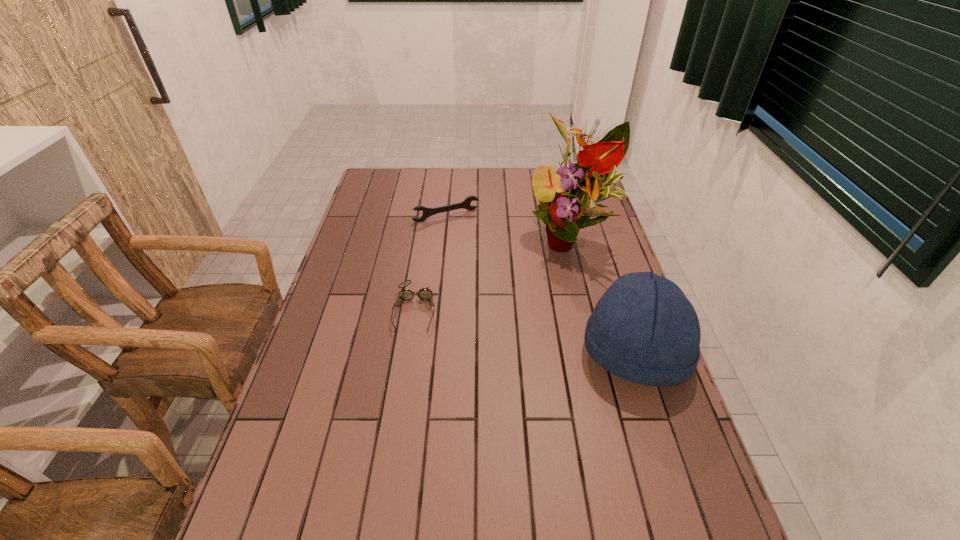
Locate an element on the screen. The height and width of the screenshot is (540, 960). free spot on the desktop that is between the spectacles and the skullcap and is positioned on the front-facing side of the bouquet is located at coordinates (544, 335).

I want to click on vacant spot on the desktop that is between the spectacles and the third shortest object and is positioned on the open ends of the second shortest object, so click(514, 329).